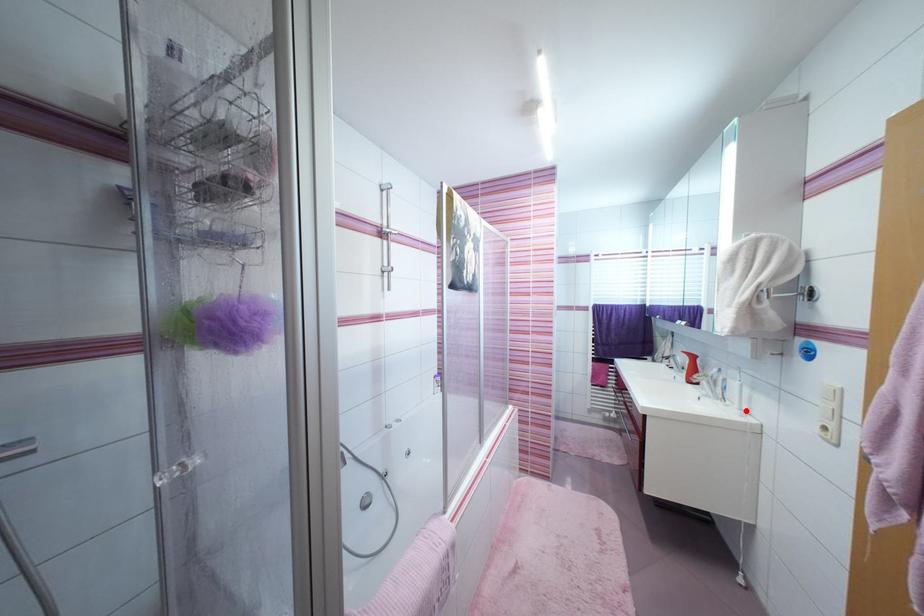
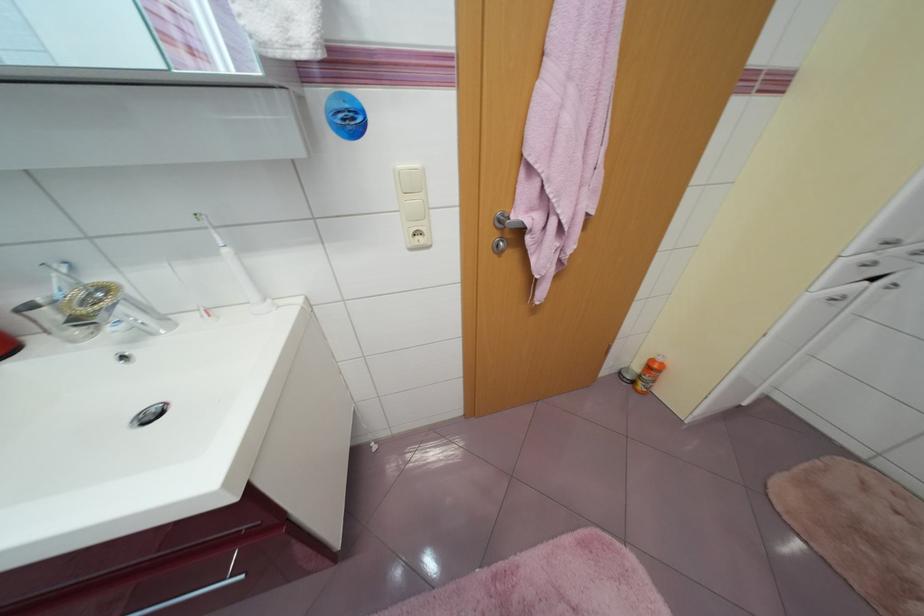
In the second image, find the point that corresponds to the highlighted location in the first image.

(270, 302)